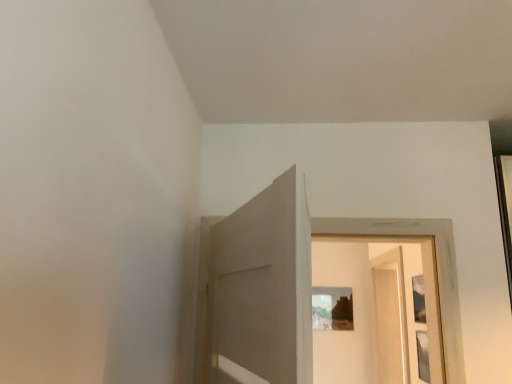
Question: Considering the positions of matte wooden picture frame at center and clear glass screen door at center in the image, is matte wooden picture frame at center bigger or smaller than clear glass screen door at center?

Choices:
 (A) small
 (B) big

Answer: (A)

Question: In terms of width, does matte wooden picture frame at center look wider or thinner when compared to clear glass screen door at center?

Choices:
 (A) thin
 (B) wide

Answer: (A)

Question: Considering the positions of matte wooden picture frame at center and clear glass screen door at center in the image, is matte wooden picture frame at center taller or shorter than clear glass screen door at center?

Choices:
 (A) short
 (B) tall

Answer: (A)

Question: Considering the positions of point (387, 322) and point (335, 289), is point (387, 322) closer or farther from the camera than point (335, 289)?

Choices:
 (A) farther
 (B) closer

Answer: (B)

Question: Is clear glass screen door at center wider or thinner than matte wooden picture frame at center?

Choices:
 (A) thin
 (B) wide

Answer: (B)

Question: From the image's perspective, is clear glass screen door at center positioned above or below matte wooden picture frame at center?

Choices:
 (A) above
 (B) below

Answer: (A)

Question: In the image, is clear glass screen door at center on the left side or the right side of matte wooden picture frame at center?

Choices:
 (A) right
 (B) left

Answer: (A)